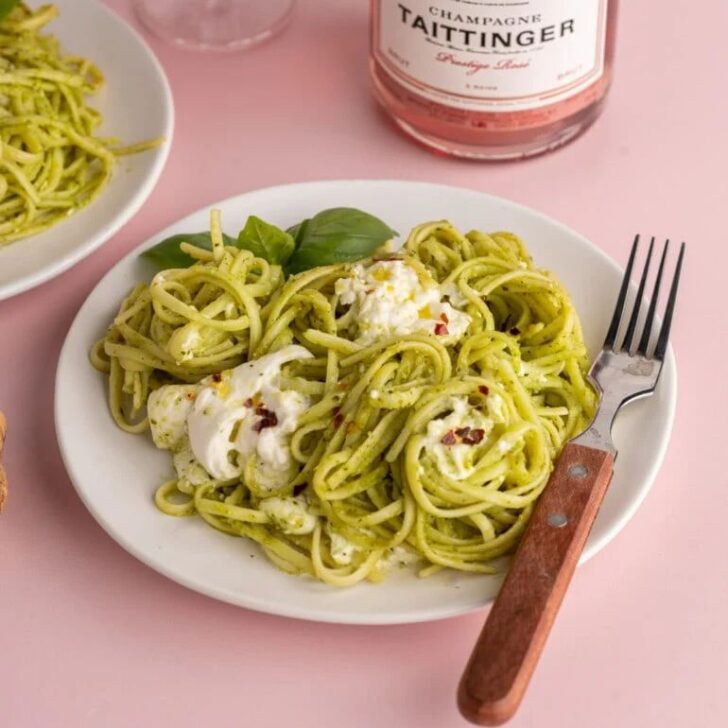
Locate an element on the screen. pink table is located at coordinates (x=301, y=113), (x=202, y=172), (x=25, y=328), (x=25, y=553), (x=146, y=673), (x=657, y=629), (x=370, y=670), (x=673, y=84), (x=605, y=165), (x=241, y=118).